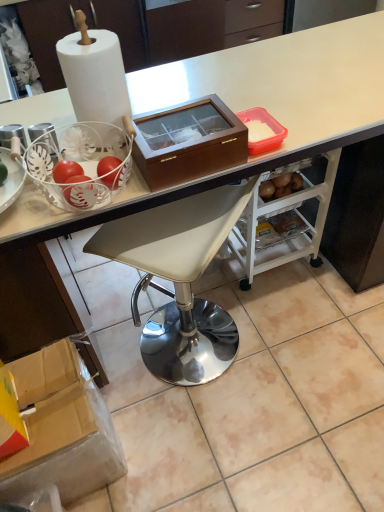
Where is `free region on the left part of white leather stool at center`? The image size is (384, 512). free region on the left part of white leather stool at center is located at coordinates (119, 344).